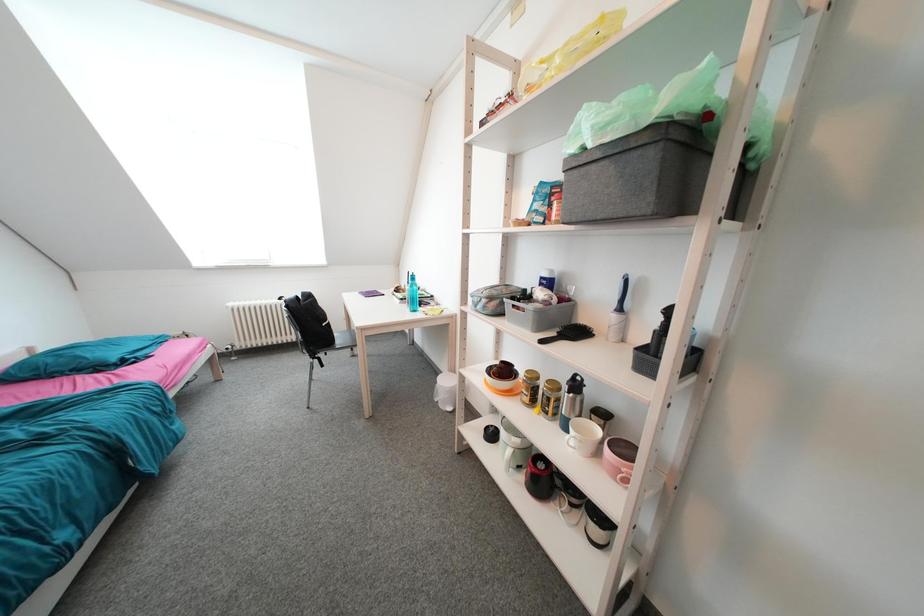
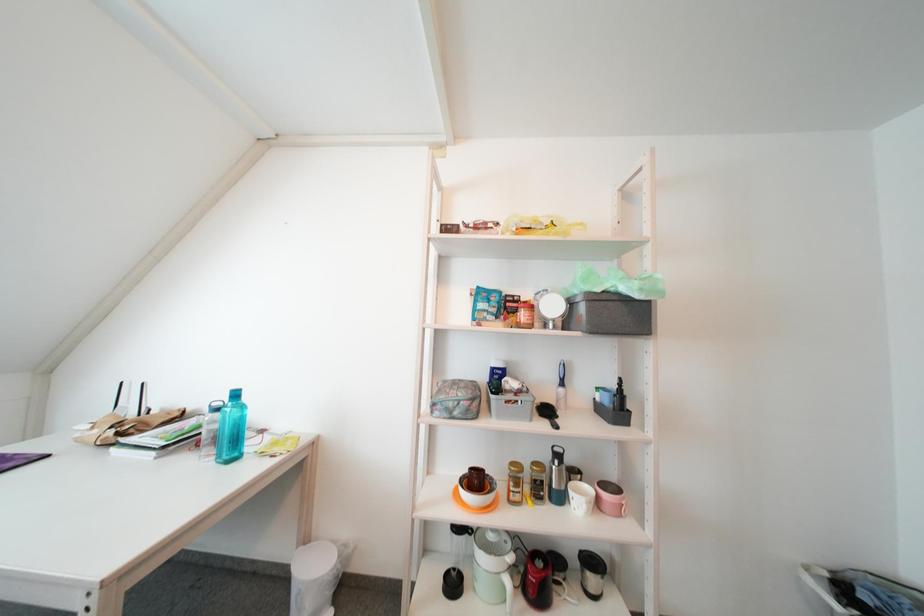
Question: Based on the continuous images, in which direction is the camera rotating? Reply with the corresponding letter.

Choices:
 (A) Left
 (B) Right
 (C) Up
 (D) Down

Answer: (B)